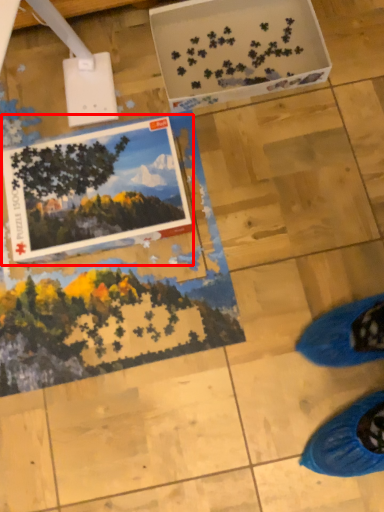
Question: Where is postcard (annotated by the red box) located in relation to cardboard box in the image?

Choices:
 (A) right
 (B) left

Answer: (B)